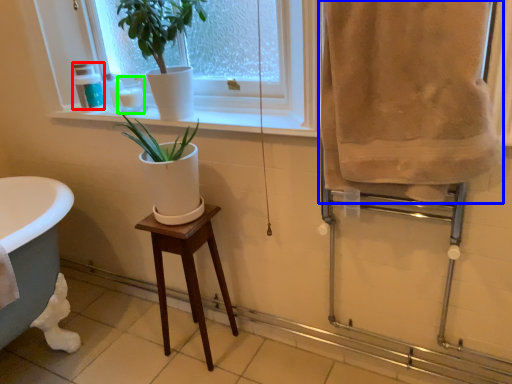
Question: Which is nearer to the toiletry (highlighted by a red box)? bath towel (highlighted by a blue box) or toiletry (highlighted by a green box).

Choices:
 (A) bath towel
 (B) toiletry

Answer: (B)